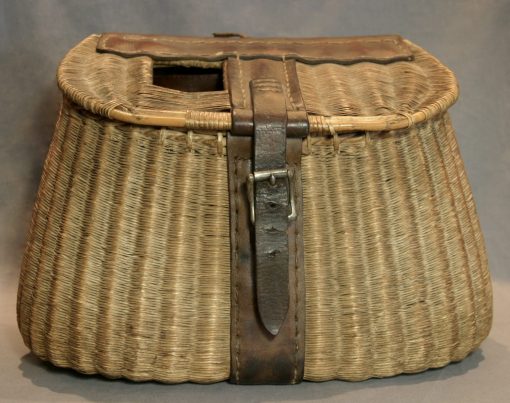
This screenshot has width=510, height=403. What are the coordinates of `floor` in the screenshot? It's located at [71, 384].